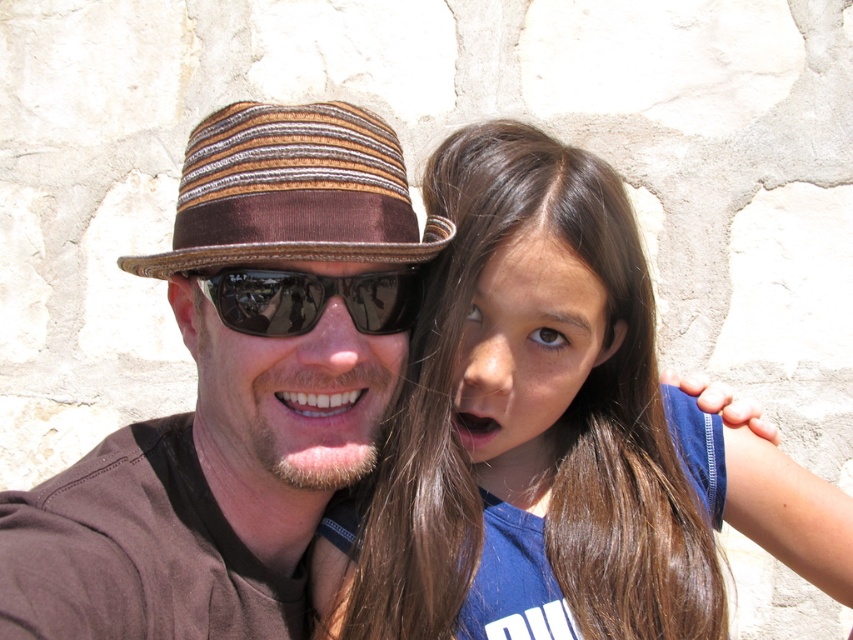
You are a photographer trying to capture a clear shot of both the brown hair at center and the brown striped fabric fedora at upper center. Which object should you focus on first to ensure both are in frame?

The brown hair at center is taller than the brown striped fabric fedora at upper center, so you should focus on the brown hair at center first to ensure both are in frame.